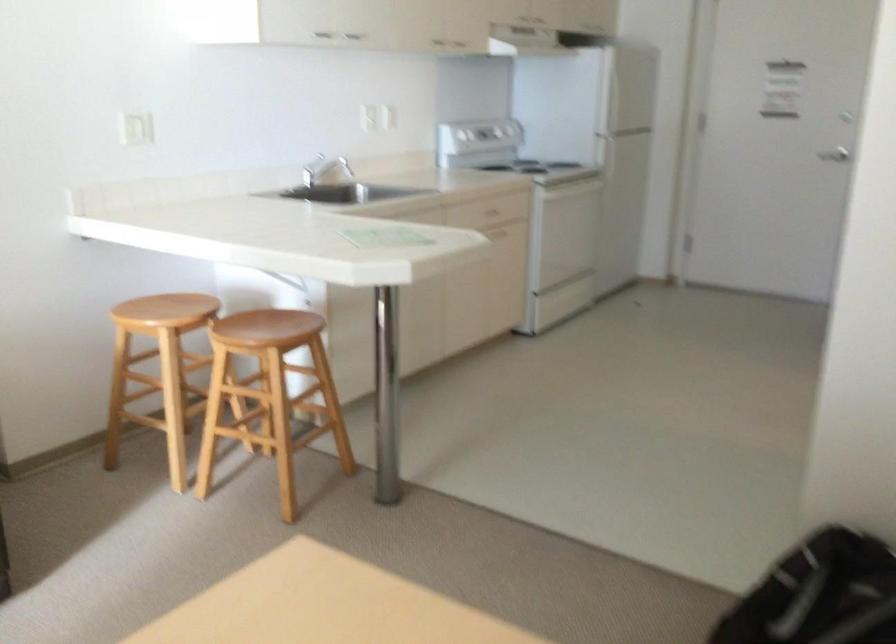
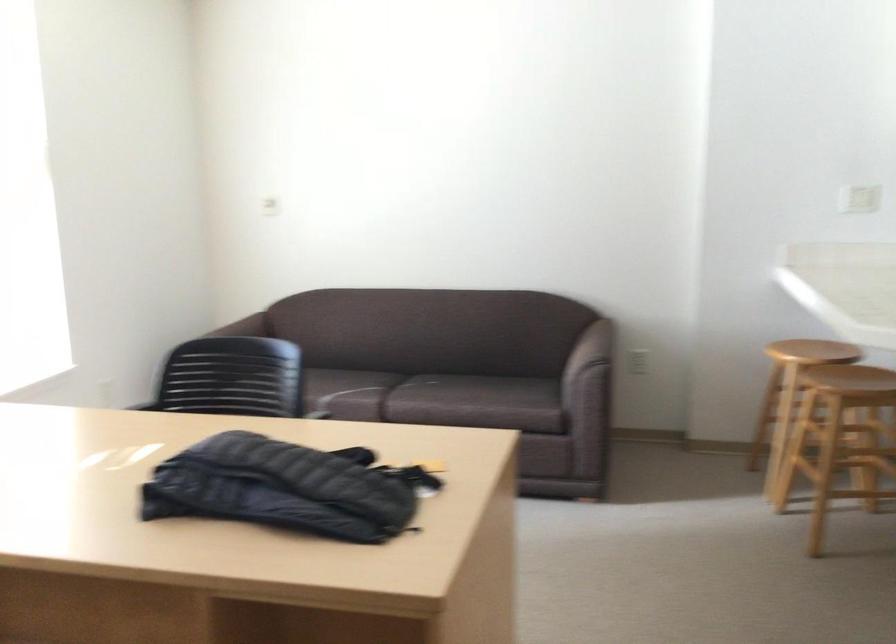
Where in the second image is the point corresponding to point 151,142 from the first image?

(858, 198)